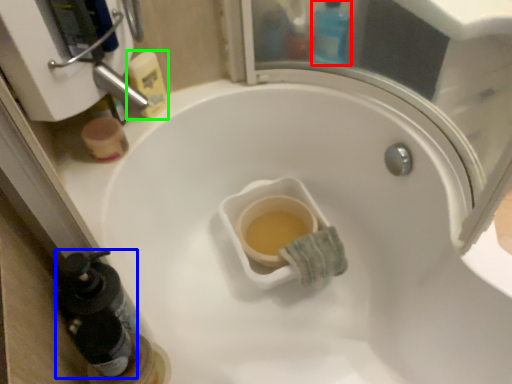
Question: Which object is the farthest from bottle (highlighted by a red box)? Choose among these: bottle (highlighted by a blue box) or cleaning product (highlighted by a green box).

Choices:
 (A) bottle
 (B) cleaning product

Answer: (A)